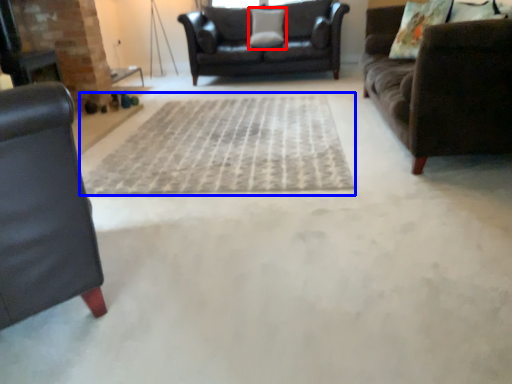
Question: Which object is closer to the camera taking this photo, pillow (highlighted by a red box) or doormat (highlighted by a blue box)?

Choices:
 (A) pillow
 (B) doormat

Answer: (B)